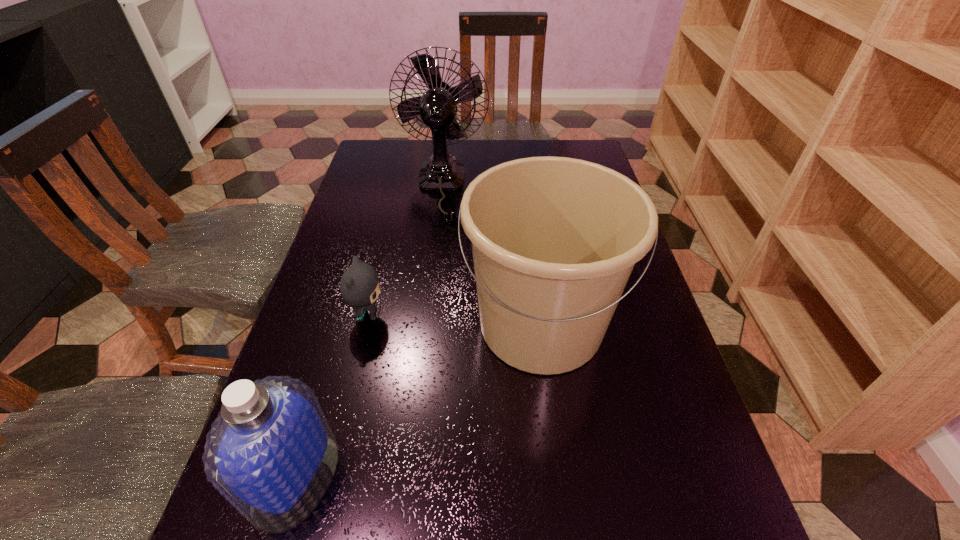
Locate an element on the screen. The width and height of the screenshot is (960, 540). fan is located at coordinates (437, 108).

Locate an element on the screen. The width and height of the screenshot is (960, 540). bucket is located at coordinates (554, 239).

At what (x,y) coordinates should I click in order to perform the action: click on the nearest object. Please return your answer as a coordinate pair (x, y). Looking at the image, I should click on (271, 453).

Where is `cleansing agent`? Image resolution: width=960 pixels, height=540 pixels. cleansing agent is located at coordinates (271, 453).

You are a GUI agent. You are given a task and a screenshot of the screen. Output one action in this format:
    pyautogui.click(x=<x>, y=<y>)
    Task: Click on the kitten
    
    Given the screenshot: What is the action you would take?
    pyautogui.click(x=359, y=285)

Where is `free space located in front of the farthest object, indicating the direction of air flow`? free space located in front of the farthest object, indicating the direction of air flow is located at coordinates (435, 236).

At what (x,y) coordinates should I click in order to perform the action: click on free space located on the left of the bucket. Please return your answer as a coordinate pair (x, y). This screenshot has width=960, height=540. Looking at the image, I should click on (411, 325).

Find the location of `free space located on the right of the third tallest object`. free space located on the right of the third tallest object is located at coordinates (373, 478).

Image resolution: width=960 pixels, height=540 pixels. I want to click on vacant space located on the front-facing side of the kitten, so click(564, 315).

I want to click on object that is positioned at the far edge, so click(x=437, y=108).